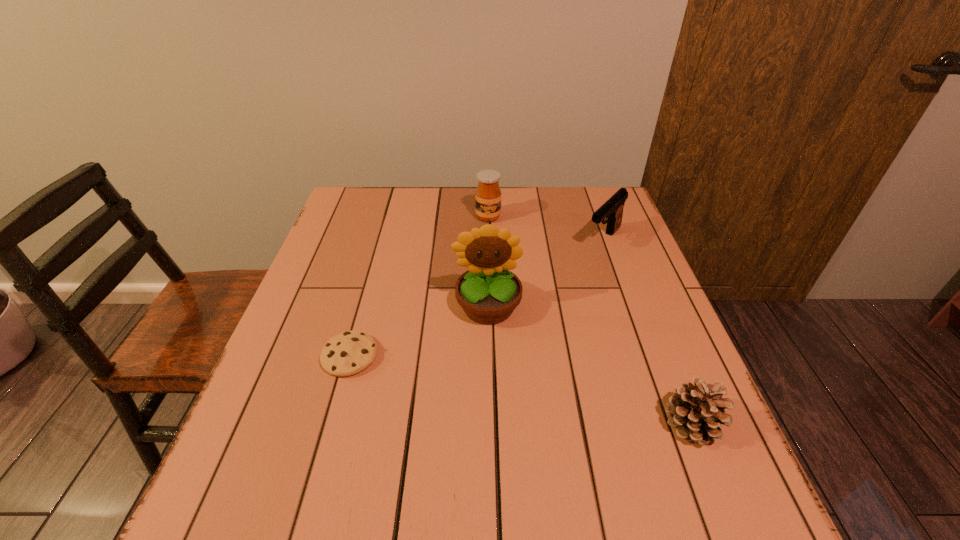
You are a GUI agent. You are given a task and a screenshot of the screen. Output one action in this format:
    pyautogui.click(x=<x>, y=<y>)
    Task: Click on the vacant space situated 0.380m on the front-facing side of the honey
    
    Given the screenshot: What is the action you would take?
    pyautogui.click(x=517, y=313)

Locate an element on the screen. The height and width of the screenshot is (540, 960). blank space located 0.220m on the front-facing side of the honey is located at coordinates (505, 271).

Identify the location of free space located on the front-facing side of the honey. This screenshot has height=540, width=960. (500, 256).

Locate an element on the screen. The height and width of the screenshot is (540, 960). vacant space situated 0.260m on the face of the sunflower is located at coordinates (495, 437).

You are a GUI agent. You are given a task and a screenshot of the screen. Output one action in this format:
    pyautogui.click(x=<x>, y=<y>)
    Task: Click on the vacant space situated on the face of the sunflower
    This screenshot has width=960, height=540.
    Given the screenshot: What is the action you would take?
    pyautogui.click(x=495, y=431)

This screenshot has width=960, height=540. What are the coordinates of `vacant position located 0.050m on the face of the sunflower` in the screenshot? It's located at (491, 348).

Identify the location of vacant region located at the barrel of the pistol. tap(521, 328).

The image size is (960, 540). What are the coordinates of `free location located at the barrel of the pistol` in the screenshot? It's located at pyautogui.click(x=569, y=279).

This screenshot has width=960, height=540. In order to click on free space located 0.110m at the barrel of the pistol in this screenshot , I will do `click(575, 273)`.

Locate an element on the screen. The height and width of the screenshot is (540, 960). honey that is at the far edge is located at coordinates (488, 194).